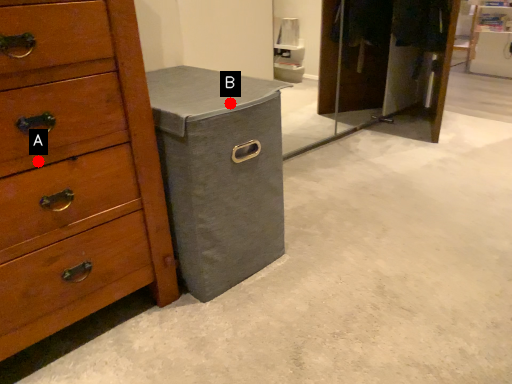
Question: Two points are circled on the image, labeled by A and B beside each circle. Among these points, which one is farthest from the camera?

Choices:
 (A) A is further
 (B) B is further

Answer: (B)